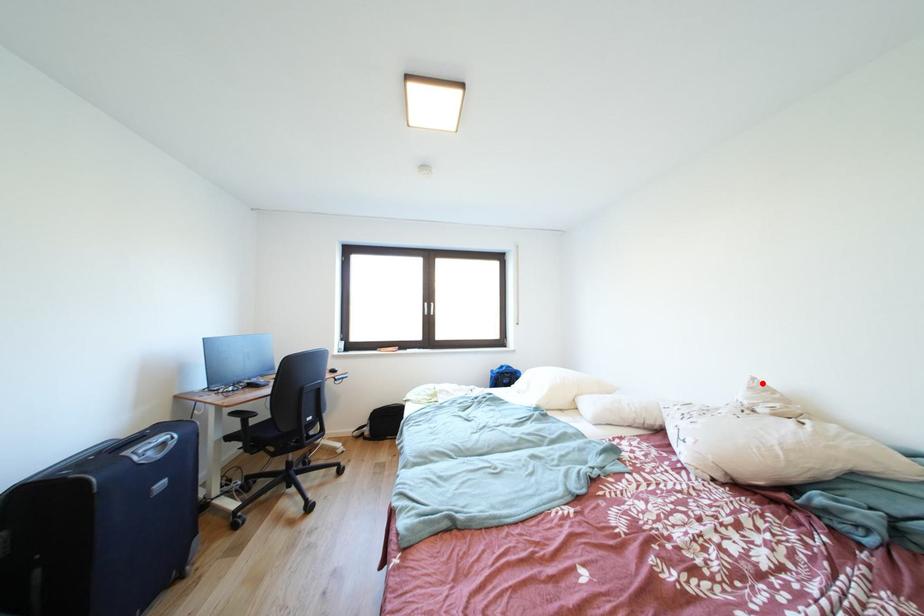
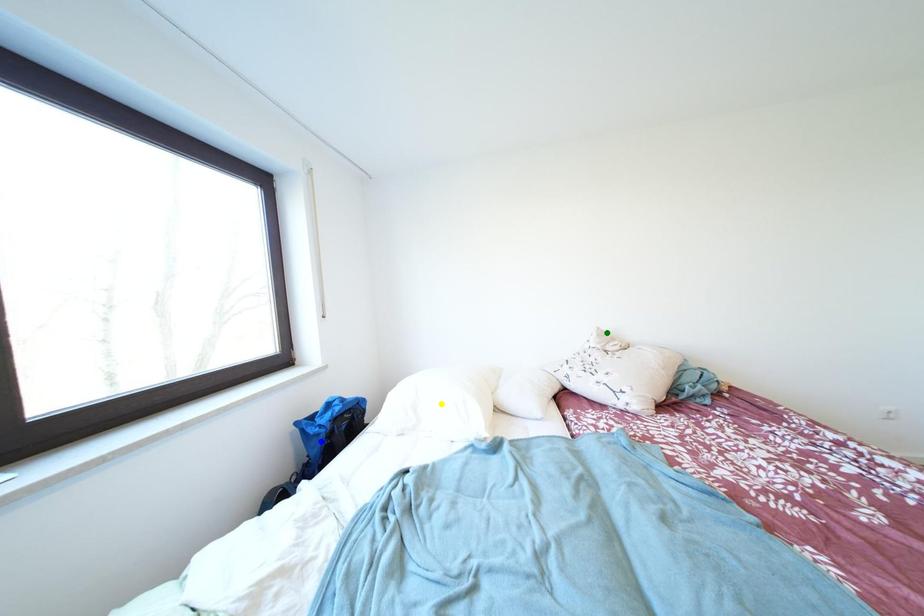
Question: I am providing you with two images of the same scene from different viewpoints. A red point is marked on the first image. You are given multiple points on the second image. In image 2, which mark is for the same physical point as the one in image 1?

Choices:
 (A) yellow point
 (B) green point
 (C) blue point

Answer: (B)